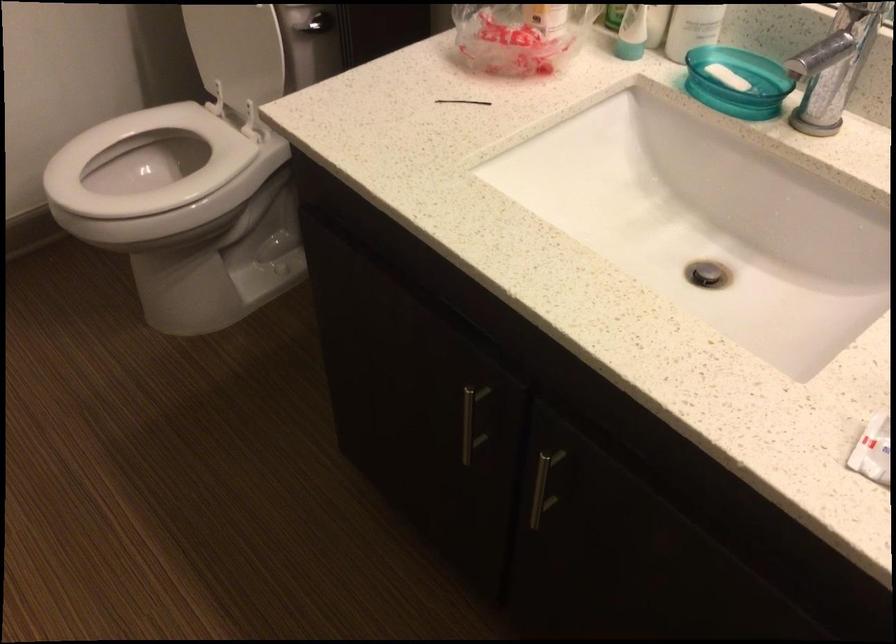
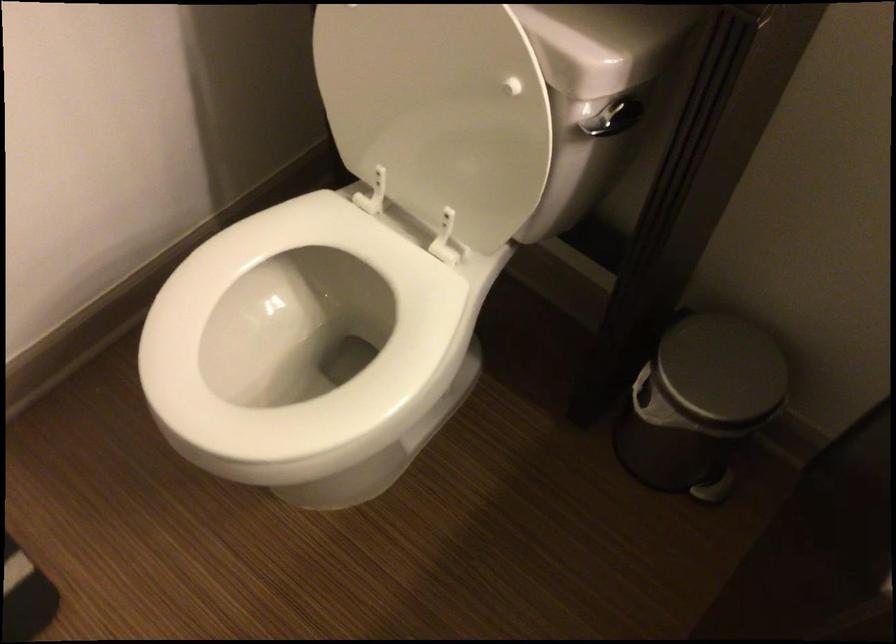
Question: The images are taken continuously from a first-person perspective. In which direction is your viewpoint rotating?

Choices:
 (A) Left
 (B) Right
 (C) Up
 (D) Down

Answer: (D)